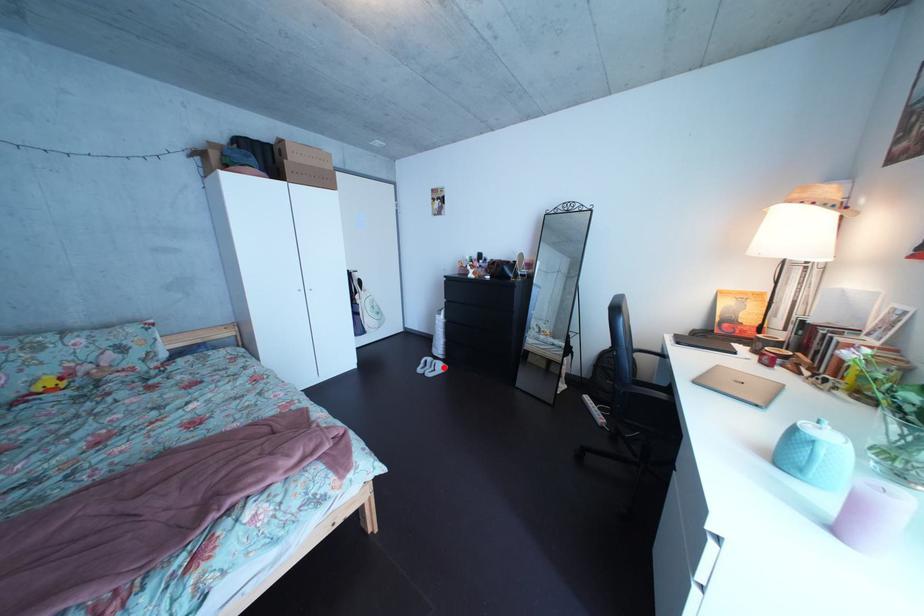
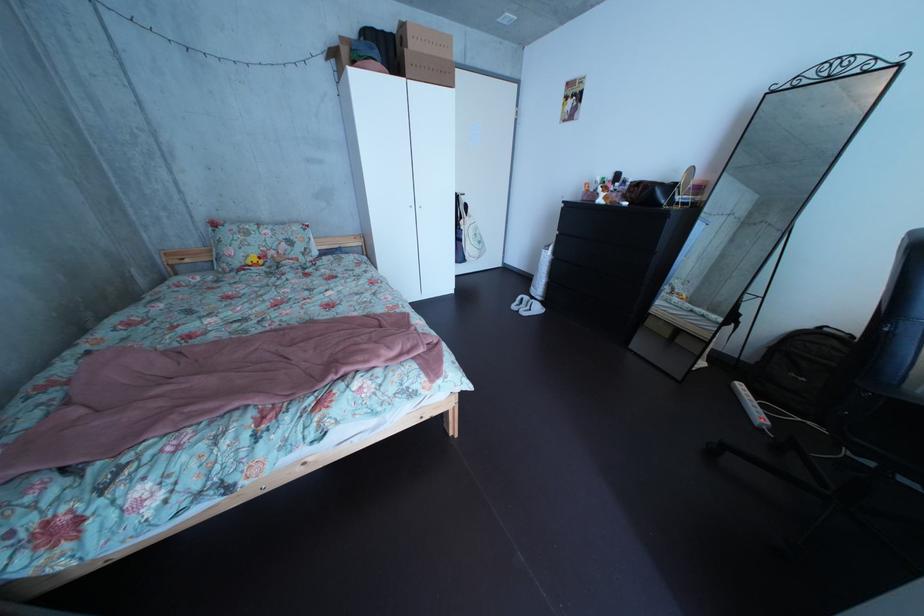
Question: I am providing you with two images of the same scene from different viewpoints. In image1, a red point is highlighted. Considering the same 3D point in image2, which of the following is correct?

Choices:
 (A) It is closer
 (B) It is farther

Answer: (A)